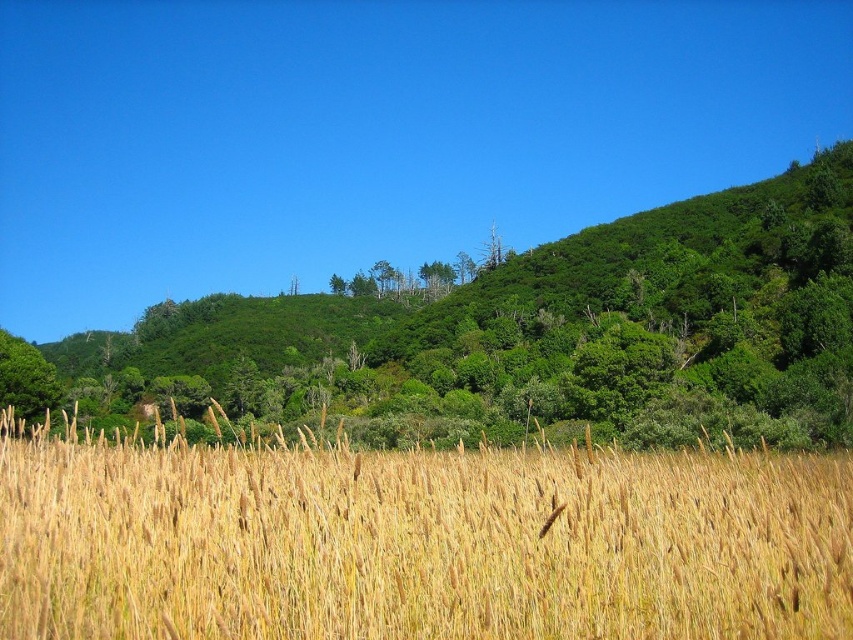
Does green leafy tree at upper center have a larger size compared to green leafy tree at left?

Yes, green leafy tree at upper center is bigger than green leafy tree at left.

Where is `green leafy tree at upper center`? green leafy tree at upper center is located at coordinates (534, 333).

Between golden grass at center and green leafy tree at left, which one is positioned higher?

golden grass at center

Between golden grass at center and green leafy tree at left, which one is positioned lower?

green leafy tree at left is below.

Does point (134, 572) come closer to viewer compared to point (36, 381)?

Yes, point (134, 572) is closer to viewer.

This screenshot has width=853, height=640. I want to click on golden grass at center, so click(416, 541).

Between golden grass at center and green leafy tree at upper center, which one has less height?

With less height is golden grass at center.

Is golden grass at center further to camera compared to green leafy tree at upper center?

No, it is not.

Where is `golden grass at center`? Image resolution: width=853 pixels, height=640 pixels. golden grass at center is located at coordinates (416, 541).

In order to click on golden grass at center in this screenshot , I will do `click(416, 541)`.